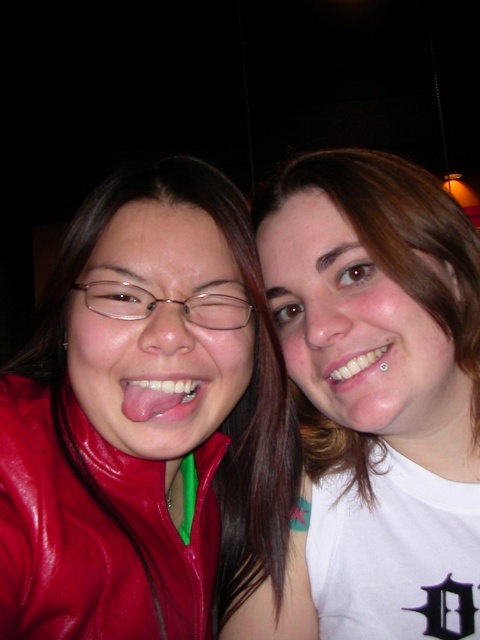
You are a photographer trying to capture the perfect shot of the two people in the image. You notice the matte white tongue at center and the white glossy teeth at center. Which of these two features is wider in the photo?

The matte white tongue at center is wider than the white glossy teeth at center in the photo.

You are holding a small toy that needs to be placed exactly at the point marked as point (87, 449) in the image. If you are standing 60 centimeters away from the scene, can you reach that point without moving closer?

The distance of point (87, 449) from the viewer is 59.18 centimeters. Since you are standing 60 centimeters away from the scene, you can reach the point without moving closer as your current distance is slightly farther than the point.

You are a photographer trying to capture a closeup shot of both the matte white tongue at center and the white glossy teeth at center in the image. Given that your camera has a depth of field that can focus on objects within a 5 inch range, will you be able to get both subjects in focus at the same time?

The matte white tongue at center is 5.19 inches away from the white glossy teeth at center. Since the distance between them exceeds the camera s 5 inch depth of field range, you won t be able to have both in focus simultaneously.